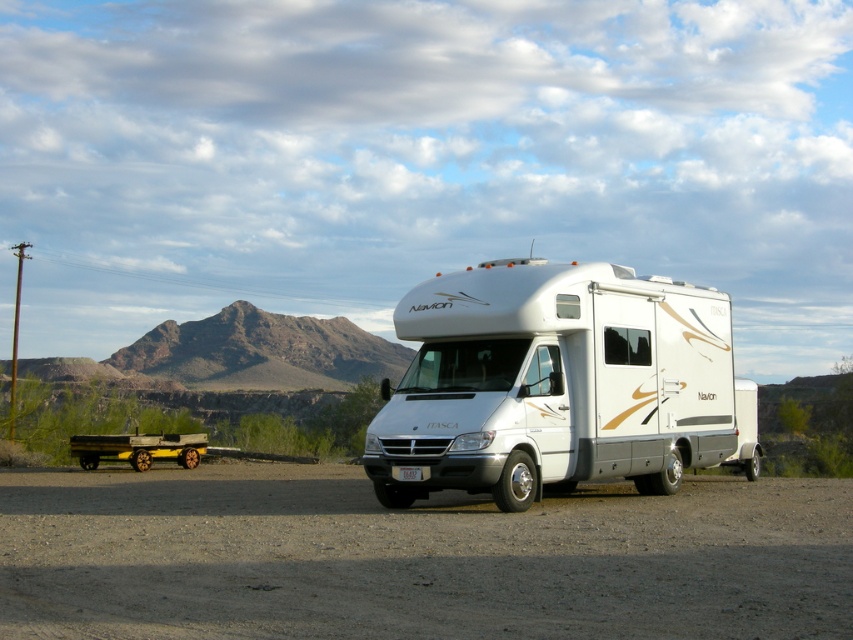
You are a delivery person needing to unload a package from your truck parked 100 feet behind the white glossy recreational vehicle at center. You need to place the package near the wooden planks at lower left. Can you walk directly from the RV to the wooden planks without crossing any obstacles?

The white glossy recreational vehicle at center and wooden planks at lower left are 50.87 feet apart. Since the distance between them is less than 100 feet, you can walk directly from the RV to the wooden planks without crossing any obstacles.

You are driving a car that is 2 meters long and want to park behind the gray gravel dirt track at center. Can you park behind it without overlapping the wooden planks at lower left?

The gray gravel dirt track at center is in front of wooden planks at lower left, so parking behind the gray gravel dirt track at center would place your car behind the wooden planks at lower left. Since the wooden planks at lower left are behind the track, you can park behind the track without overlapping them.

You are planning to drive a toy car along the gray gravel dirt track at center. Can the toy car go under the white glossy recreational vehicle at center without hitting it?

The gray gravel dirt track at center has a lesser height compared to white glossy recreational vehicle at center, so yes, the toy car can go under the white glossy recreational vehicle at center without hitting it because the track is lower than the vehicle.